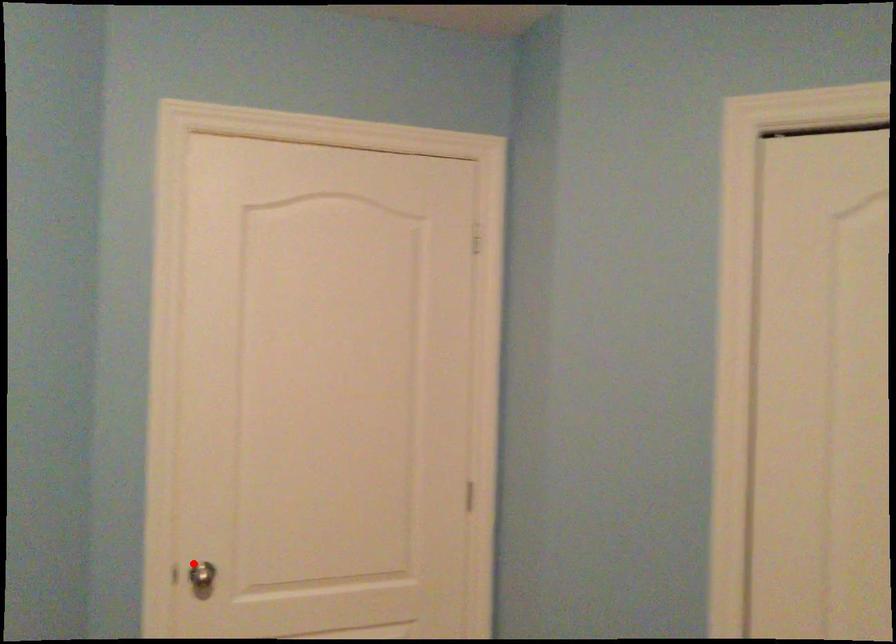
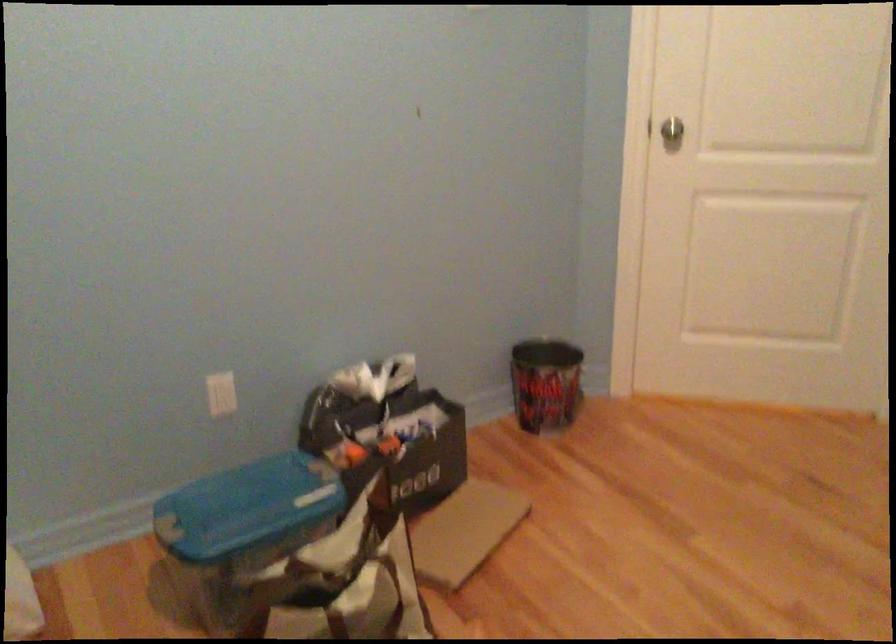
The point at the highlighted location is marked in the first image. Where is the corresponding point in the second image?

(667, 128)